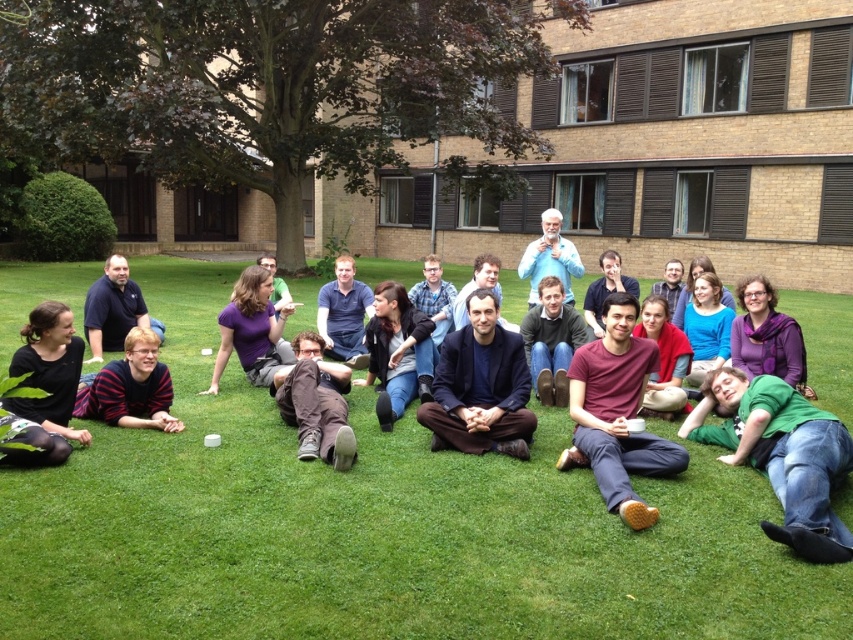
Question: Can you confirm if dark brown hair at center is smaller than blue cotton shirt at center?

Choices:
 (A) no
 (B) yes

Answer: (B)

Question: Considering the real-world distances, which object is farthest from the green grass at center?

Choices:
 (A) blue cotton shirt at center
 (B) dark brown hair at center

Answer: (A)

Question: Is green grass at center thinner than blue cotton shirt at center?

Choices:
 (A) yes
 (B) no

Answer: (B)

Question: Can you confirm if green grass at center is wider than blue cotton shirt at center?

Choices:
 (A) yes
 (B) no

Answer: (A)

Question: Which point is closer to the camera?

Choices:
 (A) blue cotton shirt at center
 (B) green grass at center

Answer: (B)

Question: Which of these objects is positioned closest to the blue cotton shirt at center?

Choices:
 (A) dark brown hair at center
 (B) green grass at center

Answer: (A)